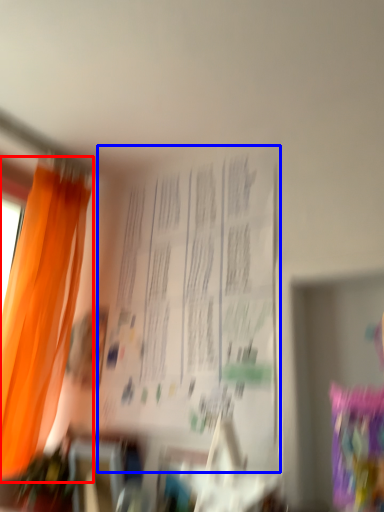
Question: Which object is further to the camera taking this photo, curtain (highlighted by a red box) or bulletin board (highlighted by a blue box)?

Choices:
 (A) curtain
 (B) bulletin board

Answer: (A)